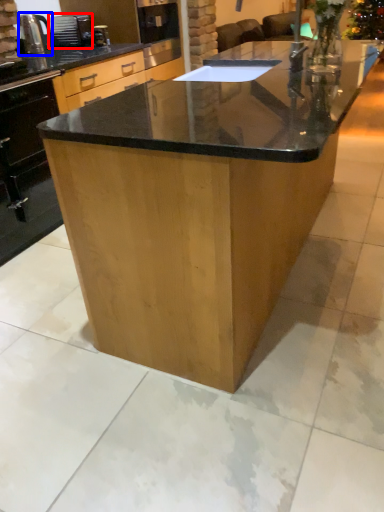
Question: Which object is closer to the camera taking this photo, appliance (highlighted by a red box) or kitchen appliance (highlighted by a blue box)?

Choices:
 (A) appliance
 (B) kitchen appliance

Answer: (B)